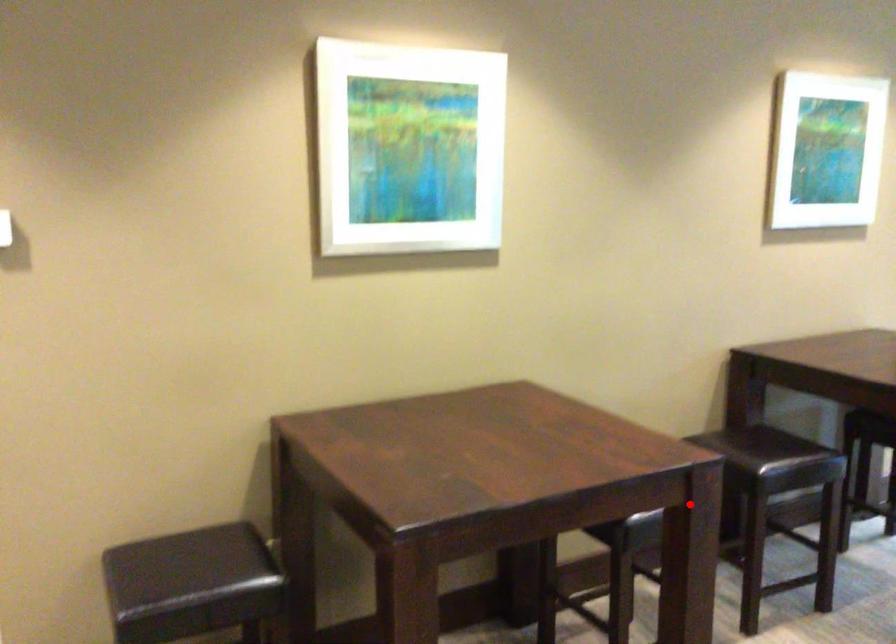
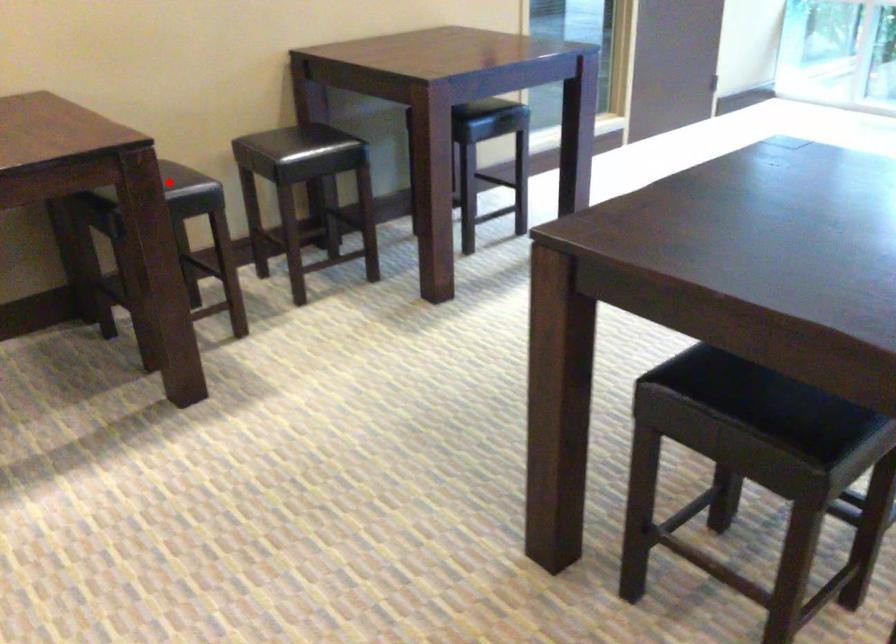
I am providing you with two images of the same scene from different viewpoints. A red point is marked on the first image and another point is marked on the second image. Are the points marked in image1 and image2 representing the same 3D position?

Yes